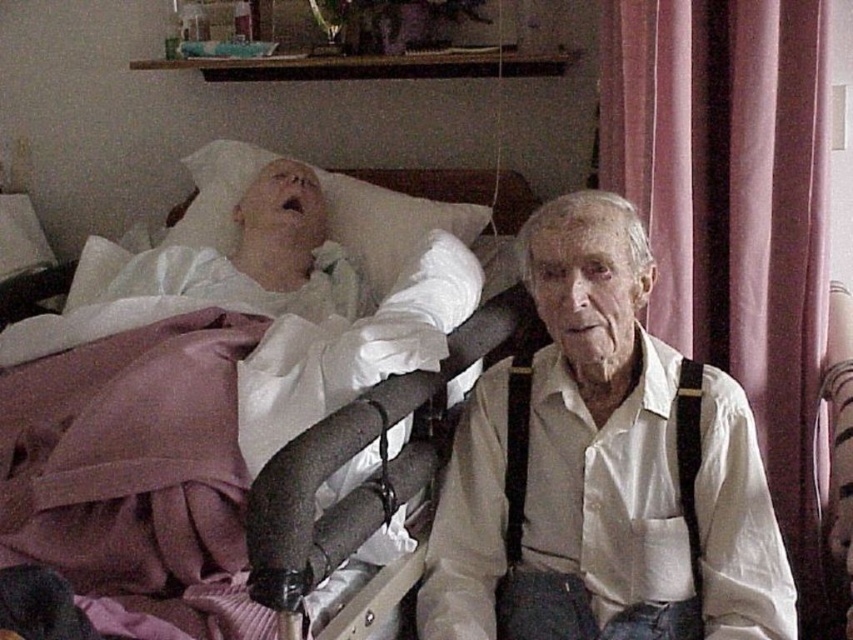
Consider the image. You are a nurse entering the hospital room and need to access the black fabric suspenders at right. However, there is a pink fabric curtain at right blocking your path. Can you reach the suspenders without moving the curtain?

The black fabric suspenders at right is behind the pink fabric curtain at right, so you cannot reach them without moving the curtain.

You are a nurse entering the hospital room and need to adjust the pink fabric curtain at right and the black fabric suspenders at right. Which object is taller?

The pink fabric curtain at right is taller than the black fabric suspenders at right.

You are a nurse entering the hospital room and need to adjust the bed. You notice the white fabric at upper left and the black fabric suspenders at right. Which of these fabrics is taller?

The white fabric at upper left is taller than the black fabric suspenders at right.